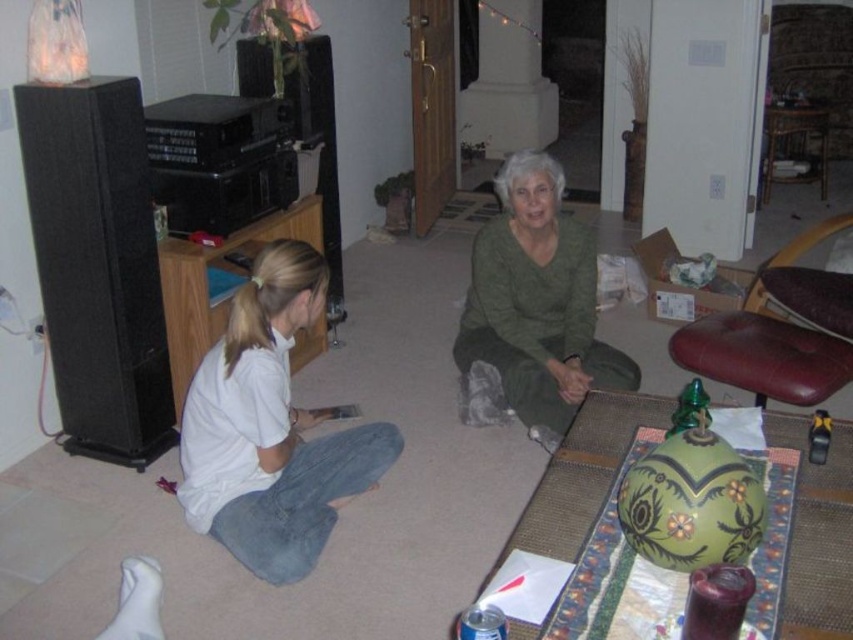
Question: Is white cotton shirt at lower left smaller than leather seat at right?

Choices:
 (A) yes
 (B) no

Answer: (A)

Question: Which is nearer to the green matte sweater at center?

Choices:
 (A) white cotton shirt at lower left
 (B) leather seat at right

Answer: (B)

Question: Observing the image, what is the correct spatial positioning of green matte sweater at center in reference to leather seat at right?

Choices:
 (A) right
 (B) left

Answer: (B)

Question: Considering the relative positions of white cotton shirt at lower left and green matte sweater at center in the image provided, where is white cotton shirt at lower left located with respect to green matte sweater at center?

Choices:
 (A) left
 (B) right

Answer: (A)

Question: Among these points, which one is nearest to the camera?

Choices:
 (A) (281, 472)
 (B) (752, 307)

Answer: (A)

Question: Which object is positioned closest to the leather seat at right?

Choices:
 (A) green matte sweater at center
 (B) white cotton shirt at lower left

Answer: (A)